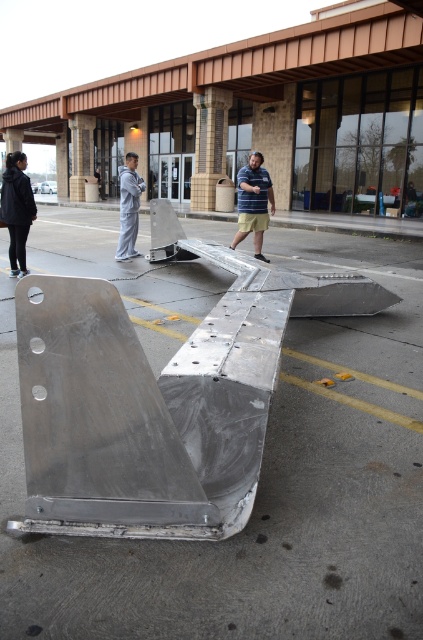
From the picture: Does silver metallic ramp at center appear on the right side of striped shirt at center?

Incorrect, silver metallic ramp at center is not on the right side of striped shirt at center.

Who is shorter, silver metallic ramp at center or striped shirt at center?

striped shirt at center

Does point (40, 240) come in front of point (252, 200)?

No, (40, 240) is further to viewer.

Identify the location of silver metallic ramp at center. (263, 492).

Between black matte jacket at left and striped shirt at center, which one appears on the left side from the viewer's perspective?

Positioned to the left is black matte jacket at left.

Is black matte jacket at left below striped shirt at center?

Yes, black matte jacket at left is below striped shirt at center.

Is point (24, 214) positioned before point (247, 189)?

That is True.

Locate an element on the screen. black matte jacket at left is located at coordinates (16, 209).

Which is in front, point (381, 516) or point (121, 221)?

Point (381, 516) is in front.

Is point (19, 467) less distant than point (129, 177)?

Yes, it is in front of point (129, 177).

Who is more forward, (3, 621) or (129, 204)?

Point (3, 621) is in front.

Identify the location of silver metallic ramp at center. (263, 492).